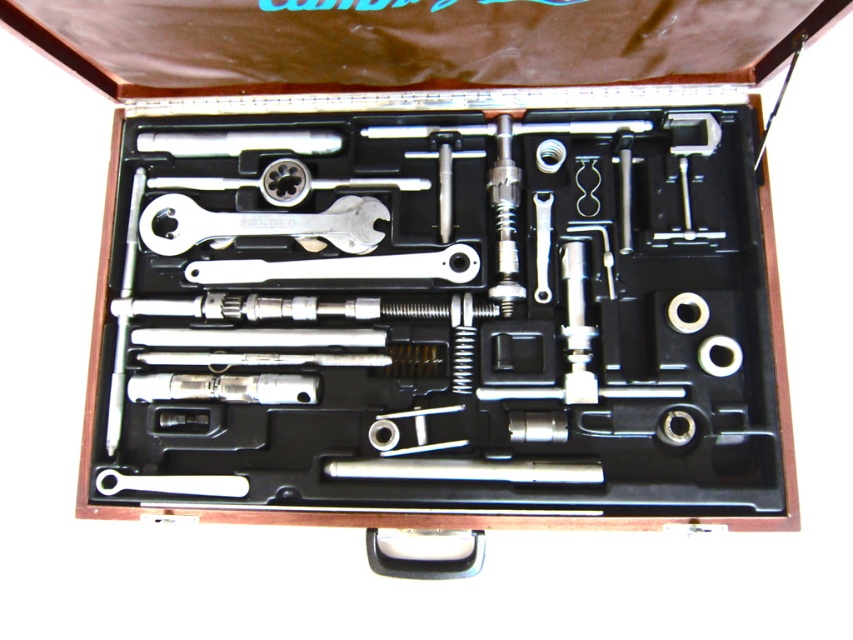
Does polished chrome wrench at center have a greater width compared to polished metal rod at center?

Yes, polished chrome wrench at center is wider than polished metal rod at center.

Is polished chrome wrench at center to the right of polished metal rod at center from the viewer's perspective?

Incorrect, polished chrome wrench at center is not on the right side of polished metal rod at center.

Identify the location of polished chrome wrench at center. The height and width of the screenshot is (640, 853). (442, 307).

Is polished metal rod at center behind white plastic wrench at lower left?

No.

Can you confirm if polished metal rod at center is smaller than white plastic wrench at lower left?

Incorrect, polished metal rod at center is not smaller in size than white plastic wrench at lower left.

In order to click on polished metal rod at center in this screenshot , I will do tap(465, 468).

Does polished chrome wrench at center appear on the right side of silver metallic wrench at center?

No, polished chrome wrench at center is not to the right of silver metallic wrench at center.

At what (x,y) coordinates should I click in order to perform the action: click on polished chrome wrench at center. Please return your answer as a coordinate pair (x, y). Looking at the image, I should click on (442, 307).